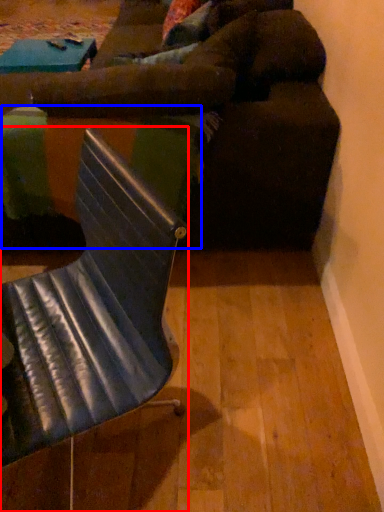
Question: Which object appears closest to the camera in this image, chair (highlighted by a red box) or table (highlighted by a blue box)?

Choices:
 (A) chair
 (B) table

Answer: (A)